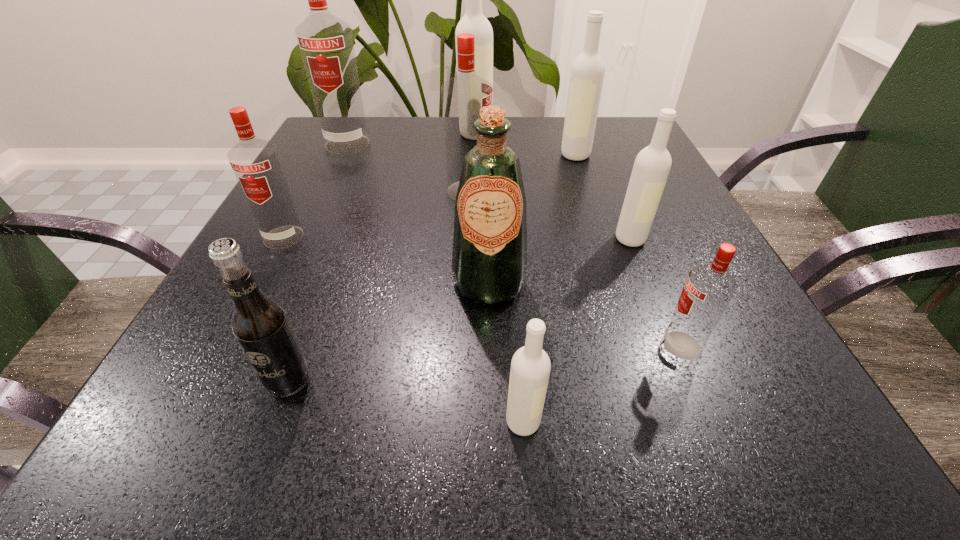
The image size is (960, 540). In order to click on vacant space in between the third farthest white vodka and the third nearest white vodka in this screenshot , I will do `click(603, 197)`.

Find the location of a particular element. Image resolution: width=960 pixels, height=540 pixels. vacant region between the second farthest white vodka and the olive oil is located at coordinates (532, 219).

Identify the location of blank region between the leftmost white vodka and the second biggest white vodka. This screenshot has width=960, height=540. (525, 144).

You are a GUI agent. You are given a task and a screenshot of the screen. Output one action in this format:
    pyautogui.click(x=<x>, y=<y>)
    Task: Click on the free spot between the root beer and the farthest red vodka
    
    Given the screenshot: What is the action you would take?
    pyautogui.click(x=318, y=262)

Locate an element on the screen. Image resolution: width=960 pixels, height=540 pixels. blank region between the third smallest red vodka and the smallest white vodka is located at coordinates (496, 306).

Where is `free space between the ninth farthest object and the farthest white vodka`? Image resolution: width=960 pixels, height=540 pixels. free space between the ninth farthest object and the farthest white vodka is located at coordinates click(x=382, y=257).

Identify the location of object that is the seventh closest to the farthest red vodka. (260, 325).

Where is `object that stands as the ninth closest to the seventh farthest object`? The image size is (960, 540). object that stands as the ninth closest to the seventh farthest object is located at coordinates (474, 22).

Locate which vodka ranks fifth in proximity to the nearest red vodka. Please provide its 2D coordinates. Your answer should be formatted as a tuple, i.e. [(x, y)], where the tuple contains the x and y coordinates of a point satisfying the conditions above.

[(256, 163)]

Identify which vodka is the seventh closest to the second smallest red vodka. Please provide its 2D coordinates. Your answer should be formatted as a tuple, i.e. [(x, y)], where the tuple contains the x and y coordinates of a point satisfying the conditions above.

[(708, 290)]